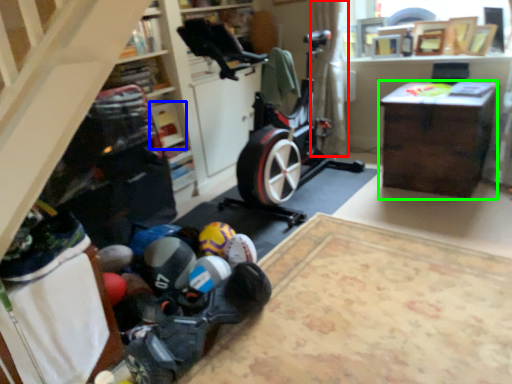
Question: Which object is the farthest from curtain (highlighted by a red box)? Choose among these: shelf (highlighted by a blue box) or desk (highlighted by a green box).

Choices:
 (A) shelf
 (B) desk

Answer: (A)